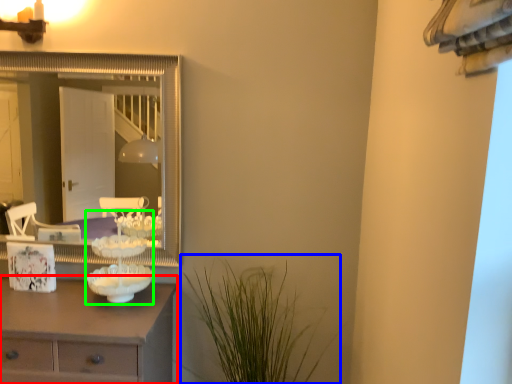
Question: Considering the real-world distances, which object is farthest from chest of drawers (highlighted by a red box)? plant (highlighted by a blue box) or candle holder (highlighted by a green box)?

Choices:
 (A) plant
 (B) candle holder

Answer: (A)